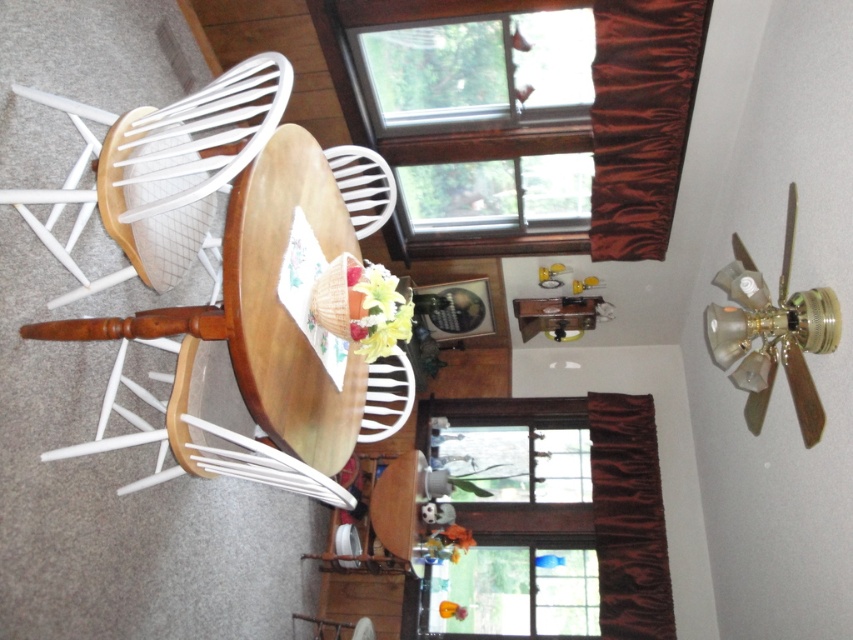
You are standing in the dining area and want to locate the brown wood window. According to the scene, where is the point at coordinates (477, 109) located?

The point at coordinates (477, 109) is on the brown wood window at upper center.